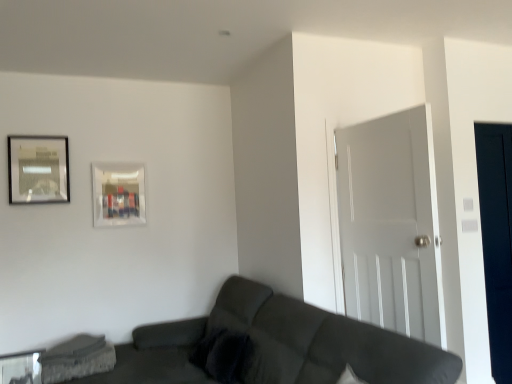
Question: Is point (347, 344) closer or farther from the camera than point (46, 355)?

Choices:
 (A) closer
 (B) farther

Answer: (A)

Question: From the image's perspective, relative to concrete textured swivel chair at lower left, is dark gray fabric couch at lower center above or below?

Choices:
 (A) below
 (B) above

Answer: (B)

Question: Estimate the real-world distances between objects in this image. Which object is farther from the transparent glass table at lower left?

Choices:
 (A) metallic silver picture frame at upper left, marked as the first picture frame in a left-to-right arrangement
 (B) matte glass picture frame at upper center, placed as the 1th picture frame when sorted from back to front
 (C) concrete textured swivel chair at lower left
 (D) dark gray fabric couch at lower center
 (E) velvety dark gray pillow at lower center

Answer: (D)

Question: Which is farther from the velvety dark gray pillow at lower center?

Choices:
 (A) transparent glass table at lower left
 (B) dark gray fabric couch at lower center
 (C) transparent glass door at right
 (D) metallic silver picture frame at upper left, acting as the 1th picture frame starting from the front
 (E) matte glass picture frame at upper center, marked as the 2th picture frame in a left-to-right arrangement

Answer: (D)